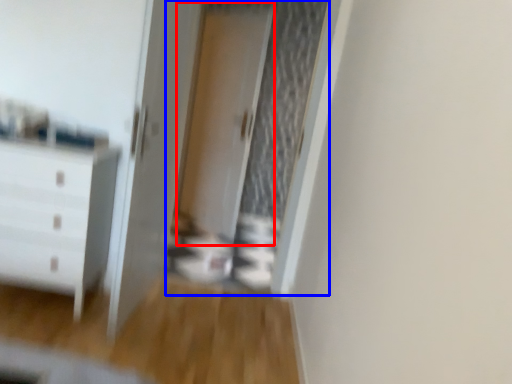
Question: Among these objects, which one is farthest to the camera, screen door (highlighted by a red box) or screen door (highlighted by a blue box)?

Choices:
 (A) screen door
 (B) screen door

Answer: (A)